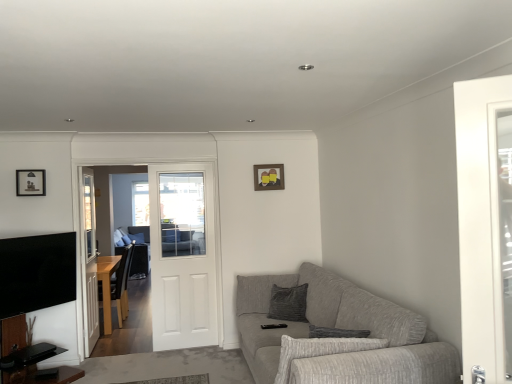
Question: From the image's perspective, relative to textured gray couch at lower right, is wooden photo frame at upper center, the 2th picture frame when ordered from left to right, above or below?

Choices:
 (A) below
 (B) above

Answer: (B)

Question: In the image, is wooden photo frame at upper center, the first picture frame when ordered from right to left, on the left side or the right side of textured gray couch at lower right?

Choices:
 (A) left
 (B) right

Answer: (A)

Question: Which is farther from the wooden photo frame at upper center, acting as the 1th picture frame starting from the back?

Choices:
 (A) white wooden door at center
 (B) brown wooden chair at left
 (C) gray fabric couch at center
 (D) clear glass door at left
 (E) matte black picture frame at upper left, the second picture frame viewed from the right

Answer: (C)

Question: Which object is positioned closest to the matte black picture frame at upper left, the second picture frame viewed from the right?

Choices:
 (A) brown wooden chair at left
 (B) textured gray couch at lower right
 (C) wooden photo frame at upper center, acting as the 1th picture frame starting from the back
 (D) gray fabric couch at center
 (E) white wooden door at center

Answer: (A)